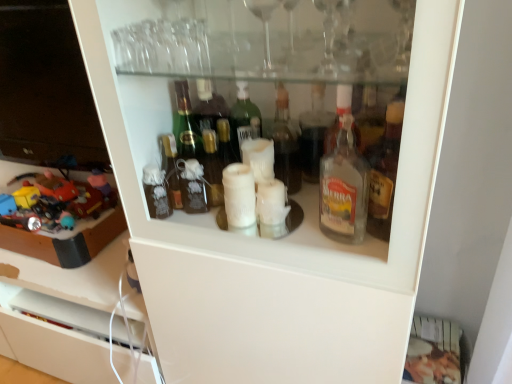
Question: Considering the positions of plastic toy car at left, placed as the first toy when sorted from right to left, and plastic toys at left, positioned as the second toy in right-to-left order, in the image, is plastic toy car at left, placed as the first toy when sorted from right to left, wider or thinner than plastic toys at left, positioned as the second toy in right-to-left order,?

Choices:
 (A) wide
 (B) thin

Answer: (B)

Question: Considering their positions, is plastic toy car at left, the 2th toy viewed from the left, located in front of or behind plastic toys at left, arranged as the first toy when viewed from the left?

Choices:
 (A) front
 (B) behind

Answer: (B)

Question: Is plastic toy car at left, the 2th toy viewed from the left, inside the boundaries of plastic toys at left, positioned as the second toy in right-to-left order, or outside?

Choices:
 (A) outside
 (B) inside

Answer: (B)

Question: Is plastic toys at left, arranged as the first toy when viewed from the left, to the left or to the right of plastic toy car at left, the 2th toy viewed from the left, in the image?

Choices:
 (A) right
 (B) left

Answer: (B)

Question: From a real-world perspective, relative to plastic toy car at left, placed as the first toy when sorted from right to left, is plastic toys at left, positioned as the second toy in right-to-left order, vertically above or below?

Choices:
 (A) below
 (B) above

Answer: (A)

Question: In terms of width, does plastic toys at left, positioned as the second toy in right-to-left order, look wider or thinner when compared to plastic toy car at left, placed as the first toy when sorted from right to left?

Choices:
 (A) wide
 (B) thin

Answer: (A)

Question: Choose the correct answer: Is plastic toys at left, positioned as the second toy in right-to-left order, inside plastic toy car at left, placed as the first toy when sorted from right to left, or outside it?

Choices:
 (A) outside
 (B) inside

Answer: (A)